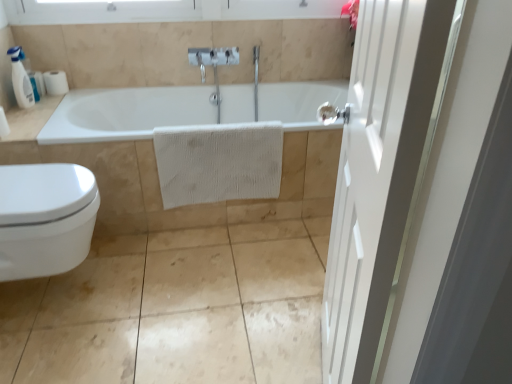
The image size is (512, 384). In order to click on free space above white textured towel at center (from a real-world perspective) in this screenshot , I will do `click(207, 126)`.